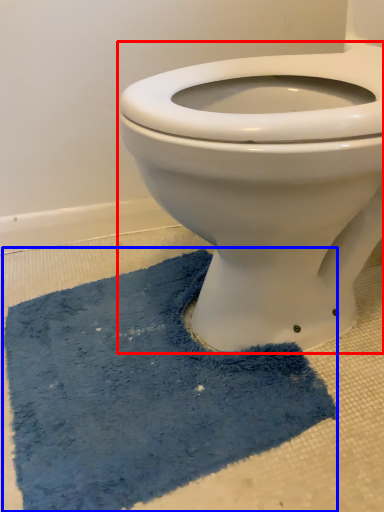
Question: Which object appears closest to the camera in this image, toilet (highlighted by a red box) or bath mat (highlighted by a blue box)?

Choices:
 (A) toilet
 (B) bath mat

Answer: (A)